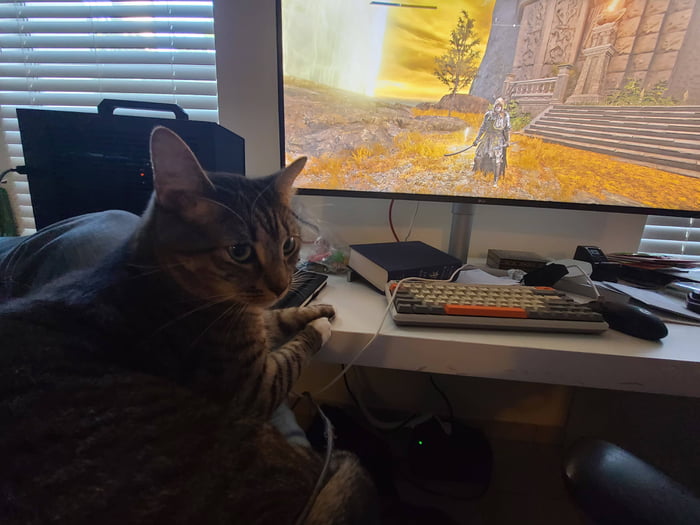
Locate an element on the screen. The width and height of the screenshot is (700, 525). handle on top of computer tower is located at coordinates (148, 102).